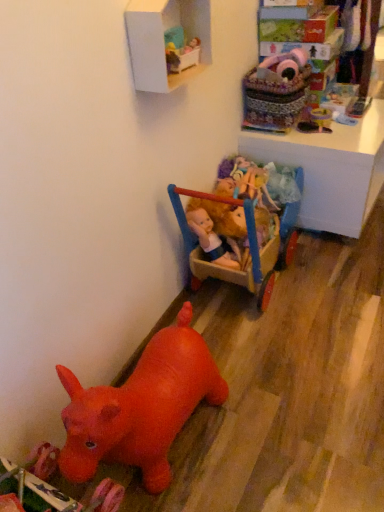
Question: From a real-world perspective, is white matte shelf at upper center under velvet pink plush at upper right, which is the second toy in top-to-bottom order?

Choices:
 (A) no
 (B) yes

Answer: (A)

Question: Is white matte shelf at upper center facing away from velvet pink plush at upper right, which is the second toy in top-to-bottom order?

Choices:
 (A) yes
 (B) no

Answer: (B)

Question: Is white matte shelf at upper center bigger than velvet pink plush at upper right, which is the fourth toy from bottom to top?

Choices:
 (A) yes
 (B) no

Answer: (B)

Question: Are white matte shelf at upper center and velvet pink plush at upper right, which is the second toy in top-to-bottom order, making contact?

Choices:
 (A) yes
 (B) no

Answer: (B)

Question: Can you confirm if white matte shelf at upper center is smaller than velvet pink plush at upper right, which is the fourth toy from bottom to top?

Choices:
 (A) no
 (B) yes

Answer: (B)

Question: Considering their positions, is rubber red horse at lower left, which ranks as the 5th toy in top-to-bottom order, located in front of or behind velvet pink plush at upper right, which is the second toy in top-to-bottom order?

Choices:
 (A) front
 (B) behind

Answer: (A)

Question: In terms of height, does rubber red horse at lower left, acting as the 1th toy starting from the bottom, look taller or shorter compared to velvet pink plush at upper right, which is the fourth toy from bottom to top?

Choices:
 (A) tall
 (B) short

Answer: (A)

Question: From the image's perspective, relative to velvet pink plush at upper right, which is the fourth toy from bottom to top, is rubber red horse at lower left, which ranks as the 5th toy in top-to-bottom order, above or below?

Choices:
 (A) below
 (B) above

Answer: (A)

Question: From a real-world perspective, is rubber red horse at lower left, which ranks as the 5th toy in top-to-bottom order, positioned above or below velvet pink plush at upper right, which is the second toy in top-to-bottom order?

Choices:
 (A) above
 (B) below

Answer: (B)

Question: In terms of width, does rubber red hippo at lower left, placed as the 4th toy when sorted from top to bottom, look wider or thinner when compared to rubber red horse at lower left, acting as the 1th toy starting from the bottom?

Choices:
 (A) thin
 (B) wide

Answer: (A)

Question: Choose the correct answer: Is rubber red hippo at lower left, placed as the 4th toy when sorted from top to bottom, inside rubber red horse at lower left, which ranks as the 5th toy in top-to-bottom order, or outside it?

Choices:
 (A) outside
 (B) inside

Answer: (A)

Question: Based on their positions, is rubber red hippo at lower left, arranged as the 2th toy when ordered from the bottom, located to the left or right of rubber red horse at lower left, which ranks as the 5th toy in top-to-bottom order?

Choices:
 (A) left
 (B) right

Answer: (B)

Question: Considering the positions of point (122, 446) and point (74, 510), is point (122, 446) closer or farther from the camera than point (74, 510)?

Choices:
 (A) closer
 (B) farther

Answer: (B)

Question: Considering their positions, is wooden doll carriage at upper right located in front of or behind pink plush toy at upper right, the 5th toy from the bottom?

Choices:
 (A) front
 (B) behind

Answer: (B)

Question: Based on their sizes in the image, would you say wooden doll carriage at upper right is bigger or smaller than pink plush toy at upper right, the 5th toy from the bottom?

Choices:
 (A) small
 (B) big

Answer: (B)